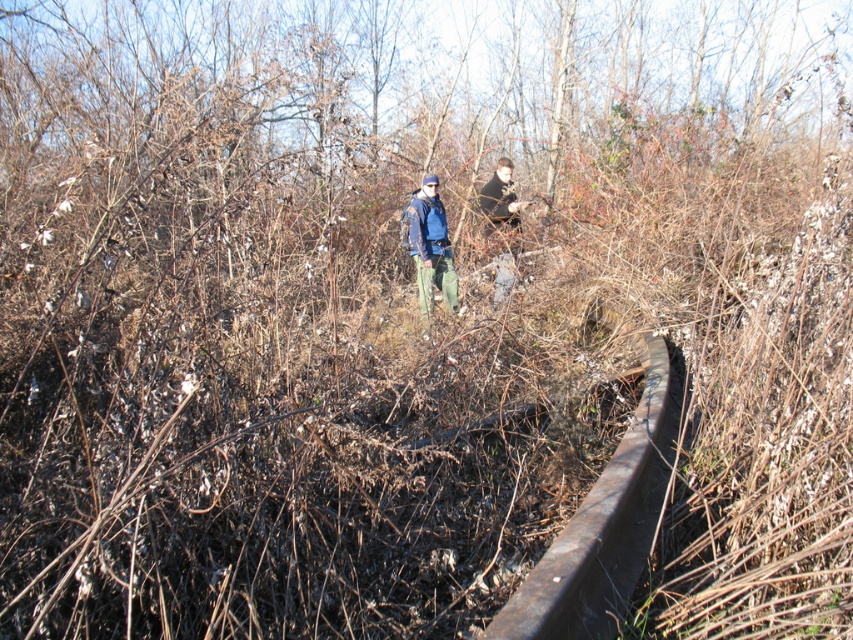
You are navigating through an overgrown area and need to locate the rusty metal rail at center. According to the coordinates provided, where exactly should you look to find it?

The rusty metal rail at center is located at coordinates point (x=604, y=525).

You are standing at the point with coordinates point [410,244] and want to walk towards the point with coordinates point [511,180]. Which direction should you move relative to your current position?

You should move backward because point [511,180] is further away from the camera than point [410,244], so moving backward would take you in the direction away from the camera towards the desired point.

You are a hiker trying to navigate through this overgrown area. You notice the rusty metal rail at center and the blue denim jacket at center. Which object is larger in size?

The rusty metal rail at center is bigger than the blue denim jacket at center, so the rusty metal rail is larger in size.